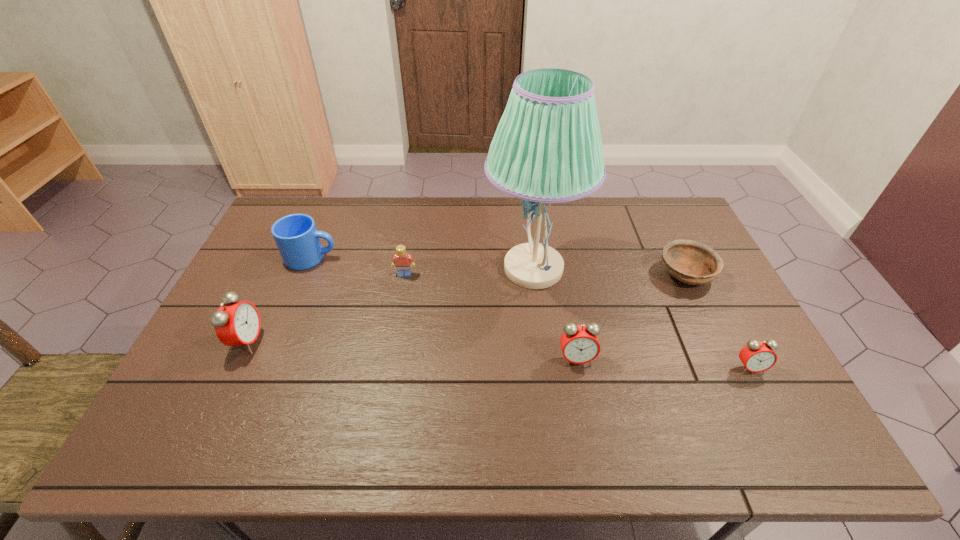
This screenshot has height=540, width=960. Find the location of `free region that satisfies the following two spatial constraints: 1. on the front side of the lamp; 2. on the right side of the bowl`. free region that satisfies the following two spatial constraints: 1. on the front side of the lamp; 2. on the right side of the bowl is located at coordinates (534, 274).